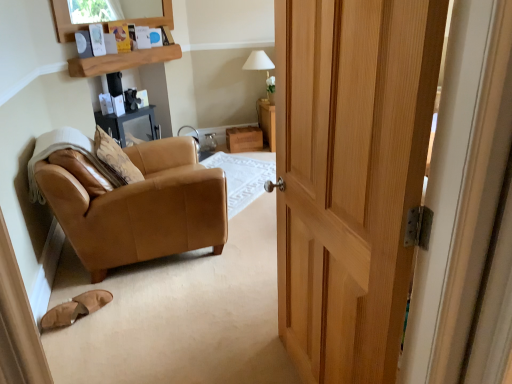
Question: From a real-world perspective, is tan leather chair at left physically above tan suede slippers at lower left?

Choices:
 (A) yes
 (B) no

Answer: (A)

Question: Does tan leather chair at left appear on the right side of tan suede slippers at lower left?

Choices:
 (A) yes
 (B) no

Answer: (A)

Question: Is tan leather chair at left smaller than tan suede slippers at lower left?

Choices:
 (A) no
 (B) yes

Answer: (A)

Question: Is tan leather chair at left looking in the opposite direction of tan suede slippers at lower left?

Choices:
 (A) yes
 (B) no

Answer: (B)

Question: From a real-world perspective, is tan leather chair at left below tan suede slippers at lower left?

Choices:
 (A) no
 (B) yes

Answer: (A)

Question: Does tan leather chair at left come in front of tan suede slippers at lower left?

Choices:
 (A) yes
 (B) no

Answer: (B)

Question: Does wooden drawer at center have a larger size compared to wooden shelf at upper center?

Choices:
 (A) yes
 (B) no

Answer: (A)

Question: Would you say wooden shelf at upper center is part of wooden drawer at center's contents?

Choices:
 (A) no
 (B) yes

Answer: (A)

Question: Is wooden drawer at center turned away from wooden shelf at upper center?

Choices:
 (A) yes
 (B) no

Answer: (B)

Question: Considering the relative sizes of wooden drawer at center and wooden shelf at upper center in the image provided, is wooden drawer at center shorter than wooden shelf at upper center?

Choices:
 (A) no
 (B) yes

Answer: (A)

Question: Is wooden drawer at center outside wooden shelf at upper center?

Choices:
 (A) yes
 (B) no

Answer: (A)

Question: From a real-world perspective, is wooden drawer at center under wooden shelf at upper center?

Choices:
 (A) yes
 (B) no

Answer: (A)

Question: Is tan suede slippers at lower left not within white fabric lampshade at upper center?

Choices:
 (A) yes
 (B) no

Answer: (A)